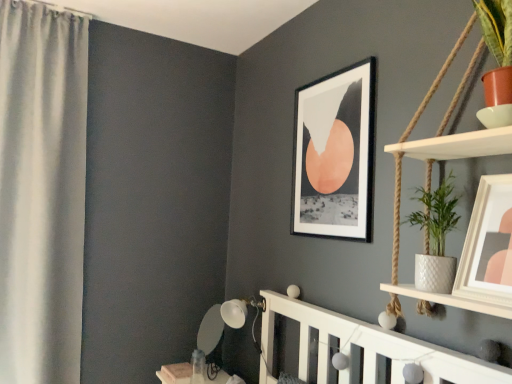
Question: Is white fabric curtain at left inside or outside of black matte picture frame at upper center, acting as the first picture frame starting from the left?

Choices:
 (A) inside
 (B) outside

Answer: (B)

Question: Looking at the image, does white fabric curtain at left seem bigger or smaller compared to black matte picture frame at upper center, which is the second picture frame from right to left?

Choices:
 (A) big
 (B) small

Answer: (A)

Question: Which object is the farthest from the matte white picture frame at upper right, the 2th picture frame from the left?

Choices:
 (A) white fabric curtain at left
 (B) black matte picture frame at upper center, which appears as the second picture frame when viewed from the front
 (C) white textured pot at right

Answer: (A)

Question: Estimate the real-world distances between objects in this image. Which object is closer to the white fabric curtain at left?

Choices:
 (A) white textured pot at right
 (B) black matte picture frame at upper center, which appears as the second picture frame when viewed from the front
 (C) matte white picture frame at upper right, the 2th picture frame from the left

Answer: (B)